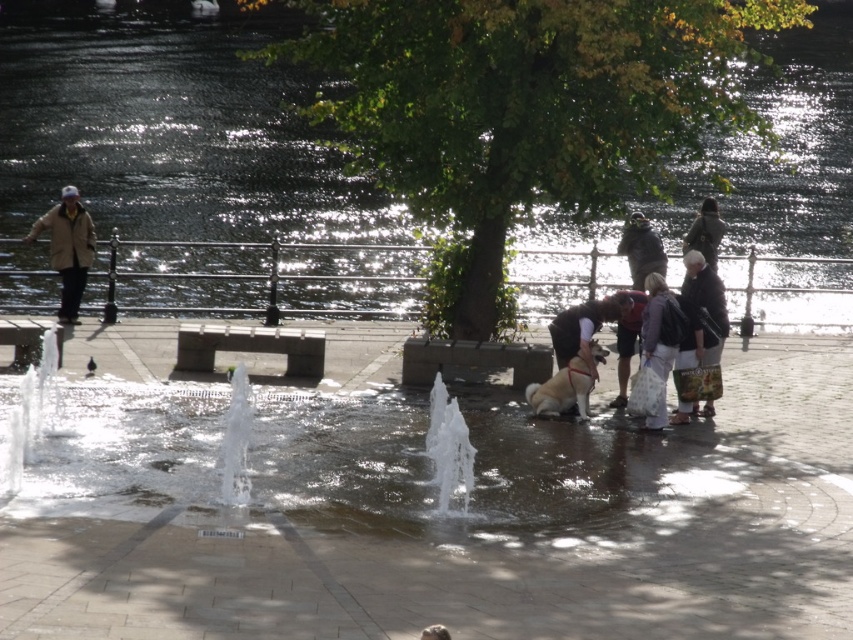
Question: Which object is the farthest from the white textured bag at center right?

Choices:
 (A) dark blue jeans at center
 (B) dark gray jacket at upper right
 (C) dark brown leather jacket at center

Answer: (B)

Question: Can you confirm if white textured bag at center right is positioned to the right of fuzzy beige dog at center?

Choices:
 (A) yes
 (B) no

Answer: (A)

Question: From the image, what is the correct spatial relationship of clear water at upper center in relation to dark brown leather jacket at center?

Choices:
 (A) above
 (B) below

Answer: (A)

Question: Can you confirm if clear water fountain at center is positioned above dark gray jacket at upper right?

Choices:
 (A) no
 (B) yes

Answer: (A)

Question: Which point is closer to the camera?

Choices:
 (A) (596, 404)
 (B) (653, 264)
 (C) (584, 362)

Answer: (C)

Question: Which object is farther from the camera taking this photo?

Choices:
 (A) clear water at upper center
 (B) clear water fountain at center

Answer: (A)